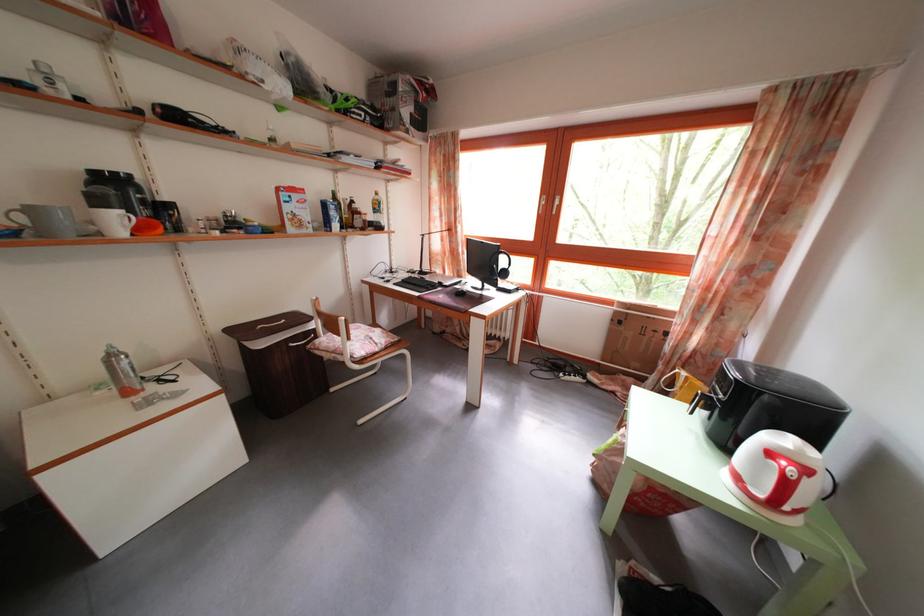
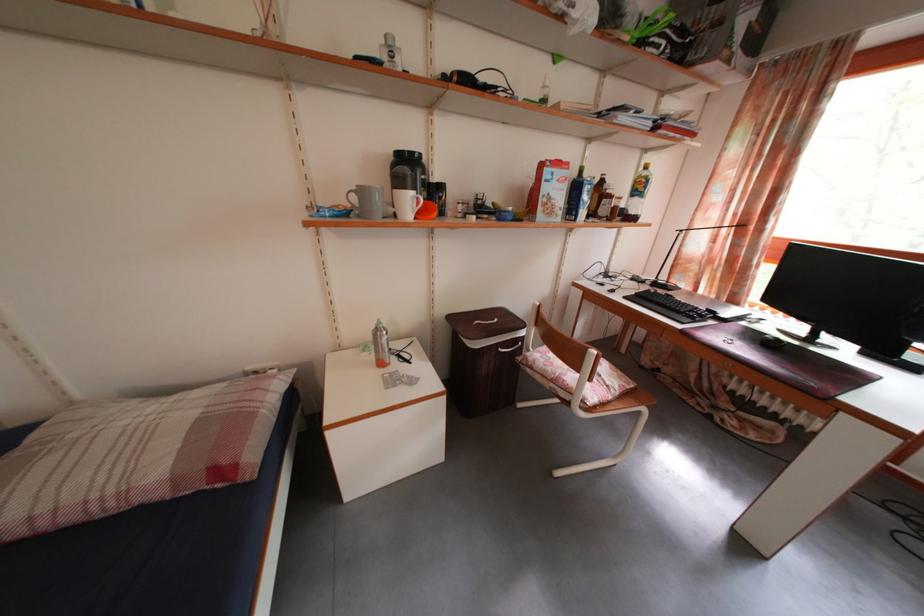
The point at (118, 363) is marked in the first image. Where is the corresponding point in the second image?

(384, 338)